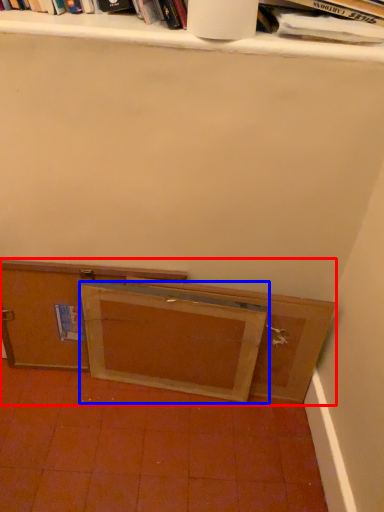
Question: Which of the following is the farthest to the observer, cabinetry (highlighted by a red box) or wide (highlighted by a blue box)?

Choices:
 (A) cabinetry
 (B) wide

Answer: (A)